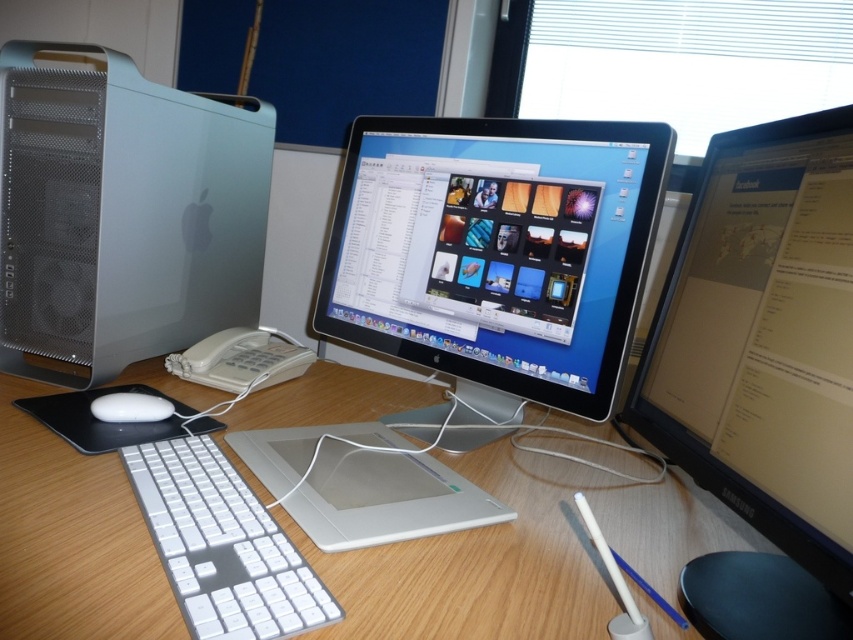
Is wooden desk at center shorter than satin black monitor at center?

Indeed, wooden desk at center has a lesser height compared to satin black monitor at center.

Does wooden desk at center appear over satin black monitor at center?

No, wooden desk at center is not above satin black monitor at center.

Is point (479, 634) farther from camera compared to point (534, 224)?

No, (479, 634) is in front of (534, 224).

Locate an element on the screen. The image size is (853, 640). wooden desk at center is located at coordinates (523, 554).

Does wooden desk at center have a larger size compared to white plastic keyboard at center?

Correct, wooden desk at center is larger in size than white plastic keyboard at center.

Can you confirm if wooden desk at center is thinner than white plastic keyboard at center?

In fact, wooden desk at center might be wider than white plastic keyboard at center.

Is point (479, 458) more distant than point (300, 560)?

Yes, point (479, 458) is behind point (300, 560).

The height and width of the screenshot is (640, 853). I want to click on wooden desk at center, so click(523, 554).

Identify the location of satin silver computer at left. Image resolution: width=853 pixels, height=640 pixels. (122, 212).

Consider the image. Who is positioned more to the right, satin silver computer at left or white plastic keyboard at center?

Positioned to the right is white plastic keyboard at center.

Measure the distance between point (192, 273) and camera.

A distance of 3.64 feet exists between point (192, 273) and camera.

Image resolution: width=853 pixels, height=640 pixels. I want to click on satin silver computer at left, so click(122, 212).